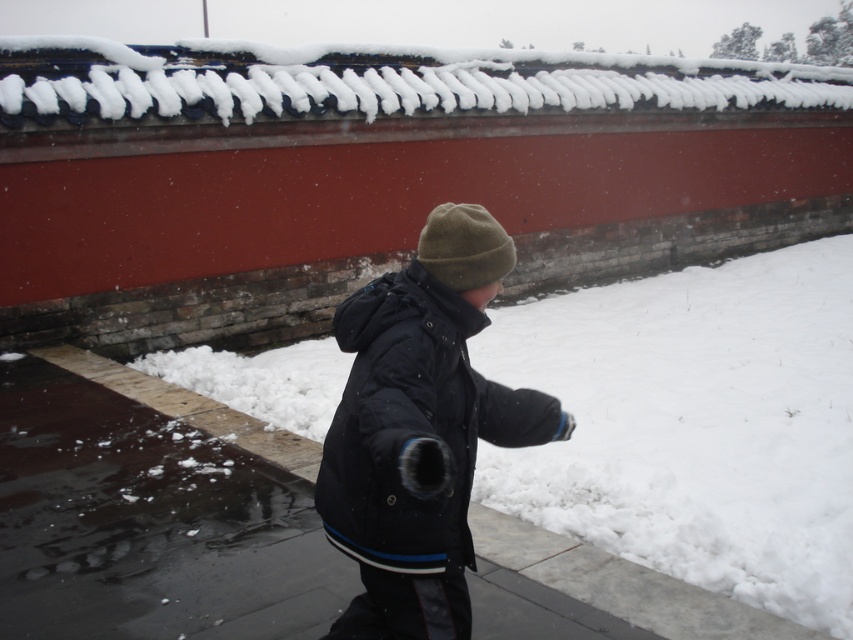
Question: Is white fluffy snow at center to the left of black matte jacket at center from the viewer's perspective?

Choices:
 (A) yes
 (B) no

Answer: (B)

Question: Which of the following is the closest to the observer?

Choices:
 (A) black matte jacket at center
 (B) white fluffy snow at center

Answer: (A)

Question: Does white fluffy snow at center have a larger size compared to black matte jacket at center?

Choices:
 (A) yes
 (B) no

Answer: (A)

Question: Which point is closer to the camera?

Choices:
 (A) green woolen beanie at center
 (B) white fluffy snow at center

Answer: (A)

Question: Considering the real-world distances, which object is closest to the green woolen beanie at center?

Choices:
 (A) black matte jacket at center
 (B) white fluffy snow at center

Answer: (A)

Question: Does white fluffy snow at center appear under green woolen beanie at center?

Choices:
 (A) yes
 (B) no

Answer: (A)